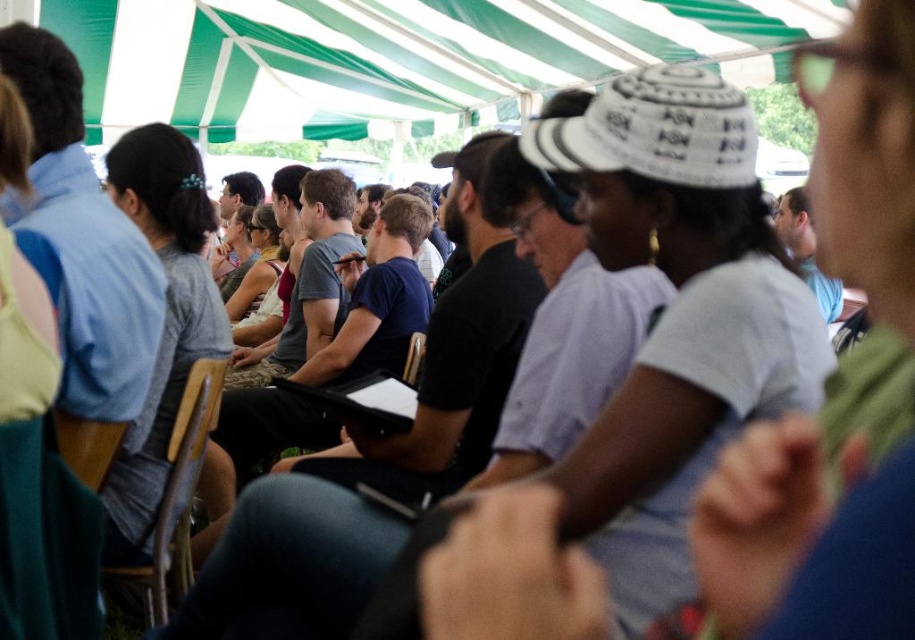
Is point (183, 516) farther from camera compared to point (124, 429)?

That is True.

Does point (222, 362) come farther from viewer compared to point (101, 442)?

Yes.

The height and width of the screenshot is (640, 915). In order to click on wooden chair at center in this screenshot , I will do `click(175, 497)`.